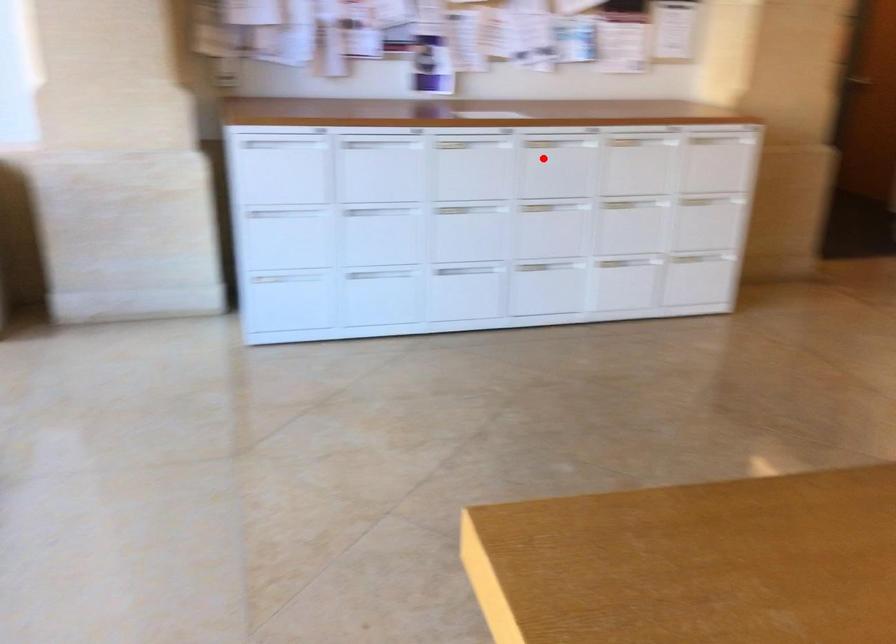
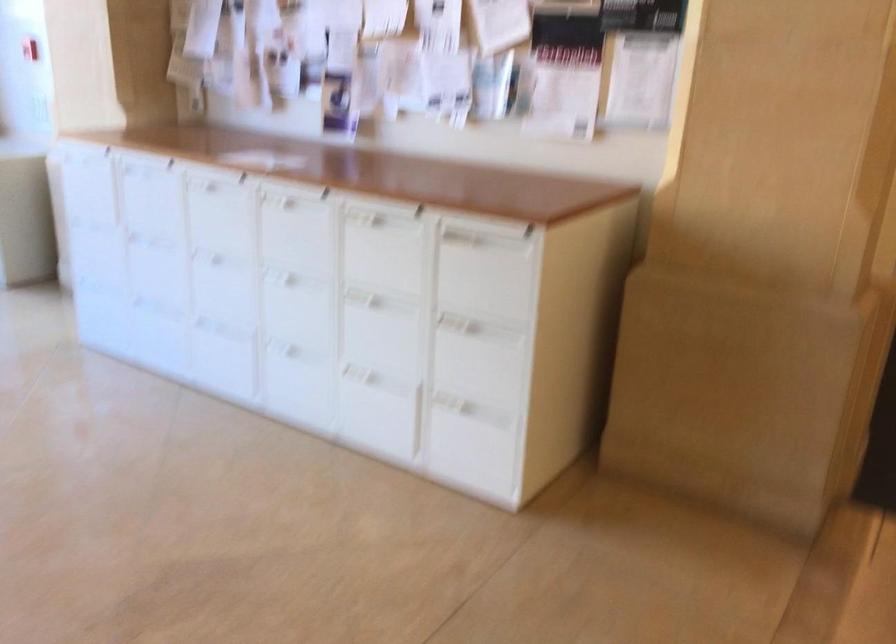
Question: I am providing you with two images of the same scene from different viewpoints. A red point is shown in image1. For the corresponding object point in image2, is it positioned nearer or farther from the camera?

Choices:
 (A) Nearer
 (B) Farther

Answer: (A)